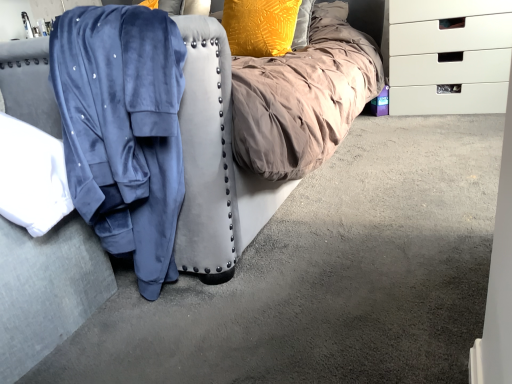
Question: Is velvet blue robe at left taller or shorter than velvet blue robe at left?

Choices:
 (A) tall
 (B) short

Answer: (A)

Question: Is velvet blue robe at left inside the boundaries of velvet blue robe at left, or outside?

Choices:
 (A) outside
 (B) inside

Answer: (A)

Question: Which of these objects is positioned closest to the white plastic chest of drawers at right?

Choices:
 (A) velvet blue robe at left
 (B) velvet blue robe at left
 (C) textured yellow pillow at upper center

Answer: (C)

Question: Estimate the real-world distances between objects in this image. Which object is closer to the velvet blue robe at left?

Choices:
 (A) white plastic chest of drawers at right
 (B) velvet blue robe at left
 (C) textured yellow pillow at upper center

Answer: (B)